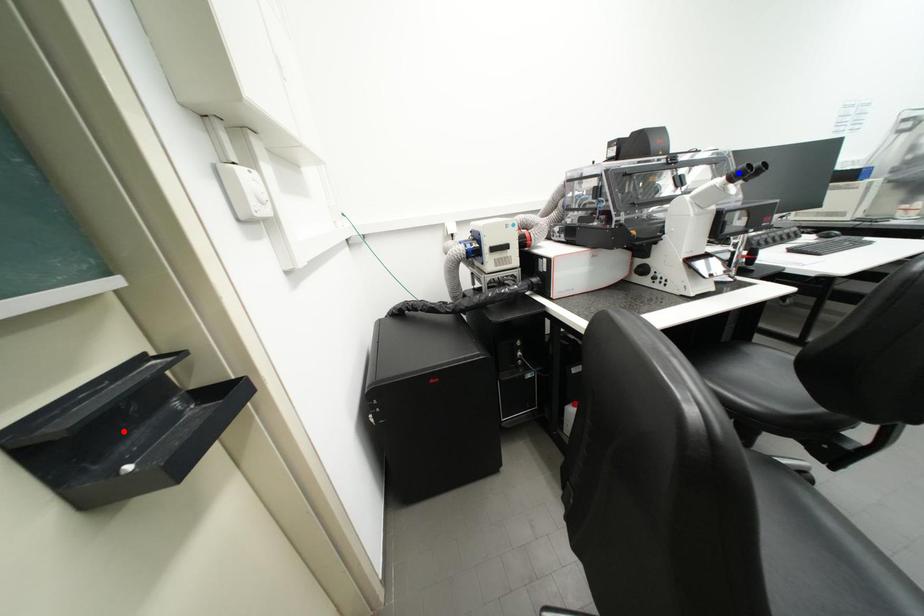
Question: In the image, two points are highlighted. Which point is nearer to the camera? Reply with the corresponding letter.

Choices:
 (A) blue point
 (B) red point

Answer: (B)